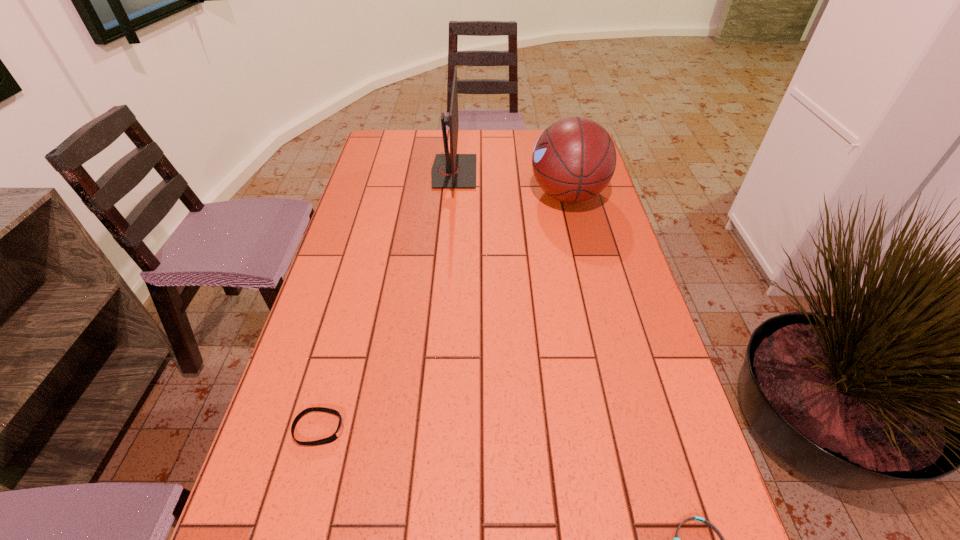
Locate an element on the screen. This screenshot has height=540, width=960. the second object from left to right is located at coordinates (450, 170).

Image resolution: width=960 pixels, height=540 pixels. Identify the location of the second tallest object. (574, 159).

This screenshot has height=540, width=960. In order to click on the third tallest object in this screenshot , I will do coord(333,437).

You are a GUI agent. You are given a task and a screenshot of the screen. Output one action in this format:
    pyautogui.click(x=<x>, y=<y>)
    Task: Click on the farther wristband
    This screenshot has height=540, width=960.
    Given the screenshot: What is the action you would take?
    pyautogui.click(x=333, y=437)

The image size is (960, 540). Identify the location of vacant point located on the screen side of the second object from left to right. (540, 172).

Find the location of a particular element. This screenshot has height=540, width=960. free space located on the back of the third shortest object is located at coordinates (560, 160).

Locate an element on the screen. free space located on the display of the leftmost object is located at coordinates (399, 429).

Identify the location of object present at the far edge. (450, 170).

At what (x,y) coordinates should I click in order to perform the action: click on object present at the left edge. Please return your answer as a coordinate pair (x, y). Looking at the image, I should click on (333, 437).

The width and height of the screenshot is (960, 540). What are the coordinates of `object at the right edge` in the screenshot? It's located at (574, 159).